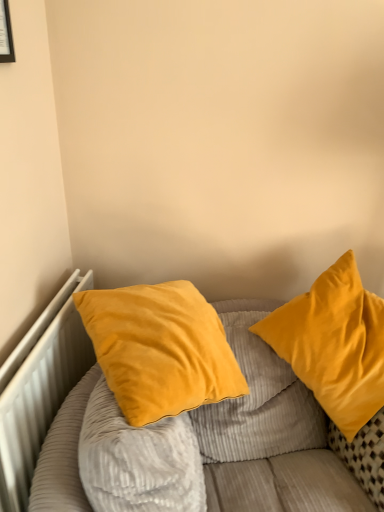
Question: Is matte black picture frame at upper left with velvet yellow pillow at right, which appears as the first pillow when viewed from the right?

Choices:
 (A) yes
 (B) no

Answer: (B)

Question: Is velvet yellow pillow at right, which appears as the first pillow when viewed from the right, at the back of matte black picture frame at upper left?

Choices:
 (A) yes
 (B) no

Answer: (B)

Question: Is matte black picture frame at upper left aimed at velvet yellow pillow at right, the 2th pillow positioned from the left?

Choices:
 (A) yes
 (B) no

Answer: (B)

Question: Is velvet yellow pillow at right, the 2th pillow positioned from the left, located within matte black picture frame at upper left?

Choices:
 (A) no
 (B) yes

Answer: (A)

Question: From the image's perspective, would you say matte black picture frame at upper left is positioned over velvet yellow pillow at right, which appears as the first pillow when viewed from the right?

Choices:
 (A) no
 (B) yes

Answer: (B)

Question: In terms of width, does white metallic radiator at left look wider or thinner when compared to velvet yellow pillow at right, which appears as the first pillow when viewed from the right?

Choices:
 (A) thin
 (B) wide

Answer: (A)

Question: Considering the positions of point (74, 374) and point (302, 334), is point (74, 374) closer or farther from the camera than point (302, 334)?

Choices:
 (A) farther
 (B) closer

Answer: (A)

Question: In the image, is white metallic radiator at left positioned in front of or behind velvet yellow pillow at right, the 2th pillow positioned from the left?

Choices:
 (A) front
 (B) behind

Answer: (A)

Question: Do you think white metallic radiator at left is within velvet yellow pillow at right, the 2th pillow positioned from the left, or outside of it?

Choices:
 (A) outside
 (B) inside

Answer: (A)

Question: Is velvet yellow pillows at upper right taller or shorter than white metallic radiator at left?

Choices:
 (A) tall
 (B) short

Answer: (A)

Question: Considering their positions, is velvet yellow pillows at upper right located in front of or behind white metallic radiator at left?

Choices:
 (A) behind
 (B) front

Answer: (B)

Question: In terms of size, does velvet yellow pillows at upper right appear bigger or smaller than white metallic radiator at left?

Choices:
 (A) small
 (B) big

Answer: (B)

Question: Is point (253, 422) closer or farther from the camera than point (49, 351)?

Choices:
 (A) farther
 (B) closer

Answer: (A)

Question: Is point (11, 30) positioned closer to the camera than point (268, 483)?

Choices:
 (A) closer
 (B) farther

Answer: (A)

Question: Is matte black picture frame at upper left wider or thinner than velvet yellow pillows at upper right?

Choices:
 (A) thin
 (B) wide

Answer: (A)